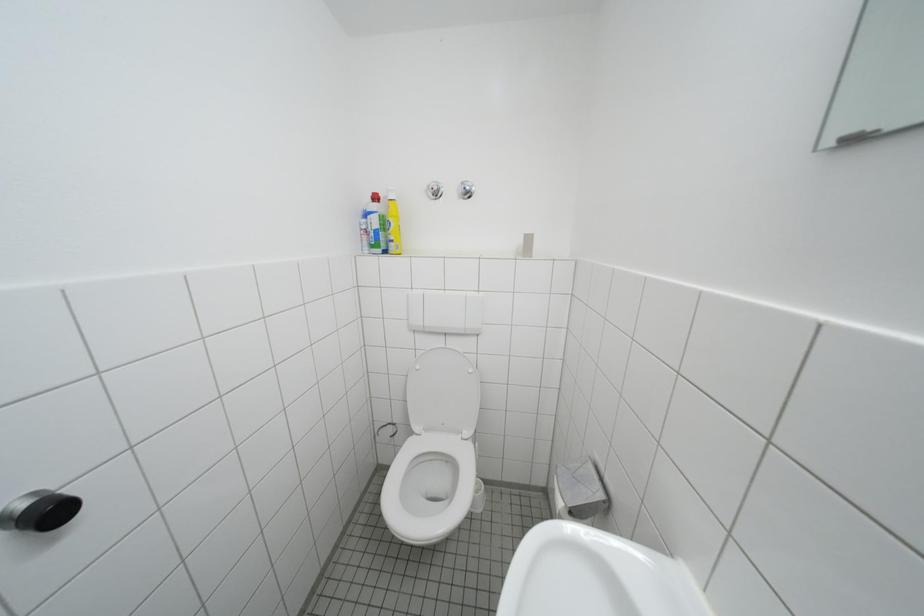
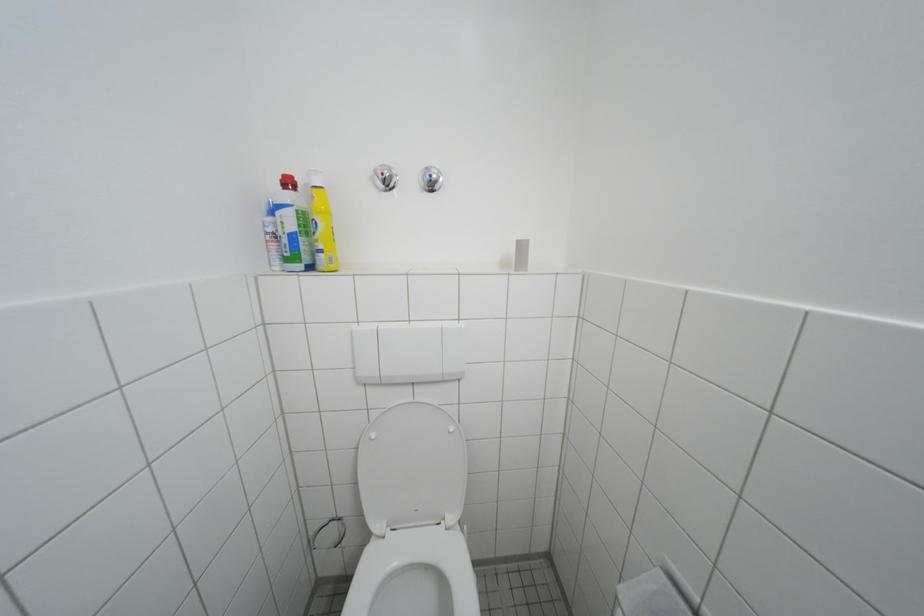
Question: Which direction would the cameraman need to move to produce the second image? Reply with the corresponding letter.

Choices:
 (A) Left
 (B) Right
 (C) Forward
 (D) Backward

Answer: (C)